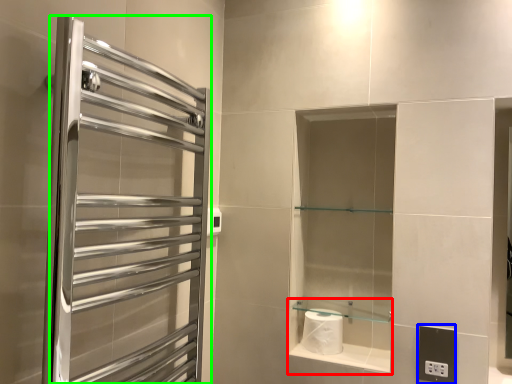
Question: Which is nearer to the cabinet (highlighted by a red box)? electric outlet (highlighted by a blue box) or screen door (highlighted by a green box).

Choices:
 (A) electric outlet
 (B) screen door

Answer: (A)